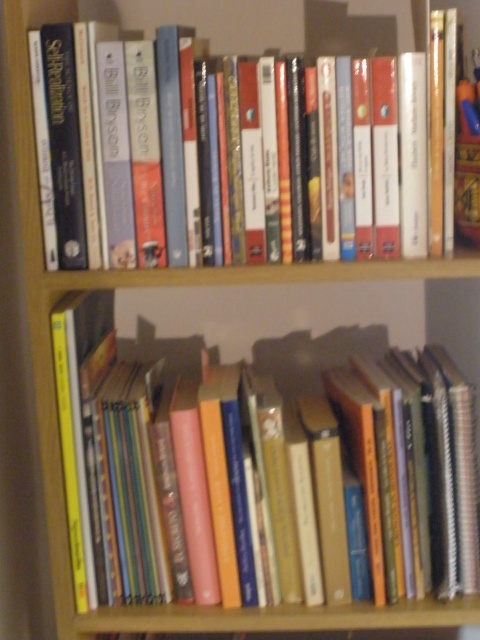
Does hardcover book at center have a greater width compared to hardcover book at upper center?

Yes.

Describe the element at coordinates (262, 476) in the screenshot. The width and height of the screenshot is (480, 640). I see `hardcover book at center` at that location.

Who is more distant from viewer, (137, 358) or (416, 138)?

The point (137, 358) is more distant.

Find the location of `hardcover book at center`. hardcover book at center is located at coordinates (262, 476).